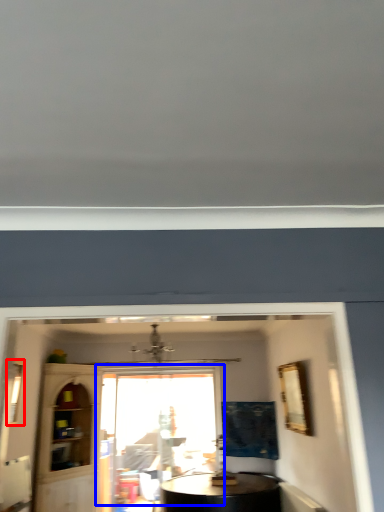
Question: Which point is closer to the camera, window (highlighted by a red box) or window (highlighted by a blue box)?

Choices:
 (A) window
 (B) window

Answer: (A)